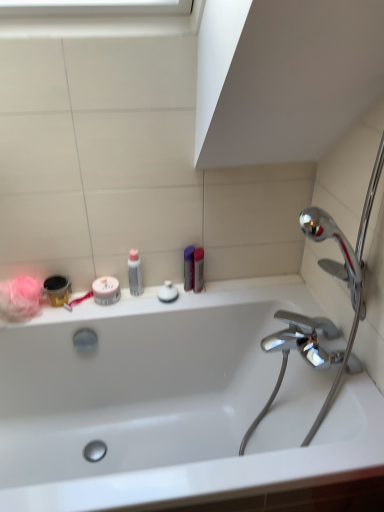
At what (x,y) coordinates should I click in order to perform the action: click on spots to the right of white matte jar at center, marked as the first mouthwash in a left-to-right arrangement. Please return your answer as a coordinate pair (x, y). Looking at the image, I should click on (144, 306).